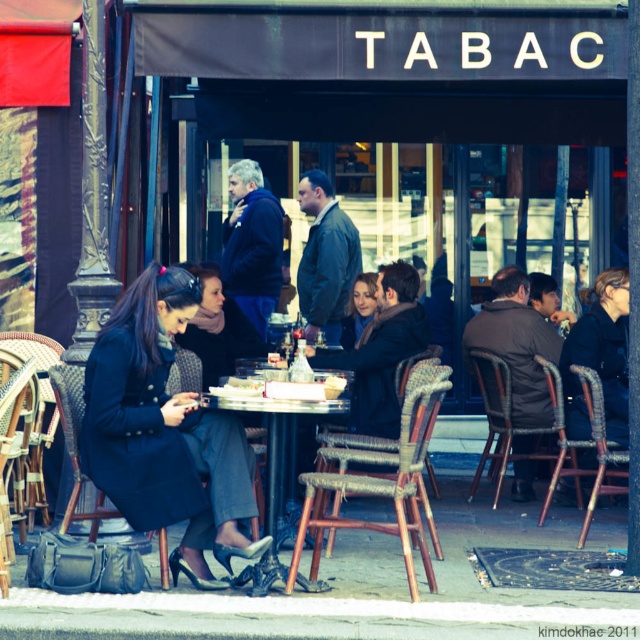
You are a delivery person who needs to leave a package at the TABAC shop. The shop requires that packages be placed exactly at the point specified by the coordinates given. The coordinates provided are point (164, 432). Where should you place the package?

The point (164, 432) corresponds to the matte black coat at left, so you should place the package at the matte black coat at left.

You are a photographer standing in front of the wooden table at center and the matte black coat at left. Which object is nearer to you?

The matte black coat at left is closer to the viewer than the wooden table at center.